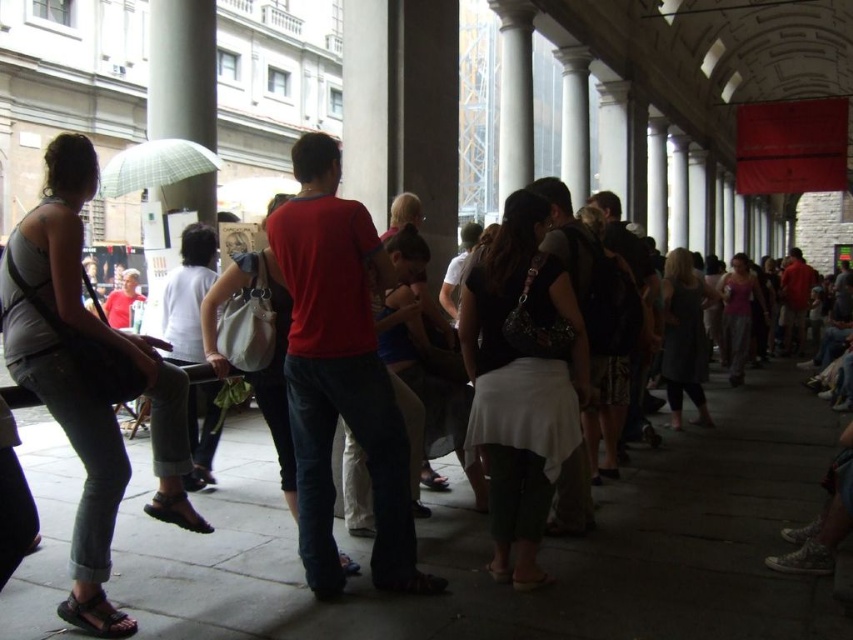
You are standing at the camera position and want to take a photo of the black textured skirt at center. Considering the distance, will you need a zoom lens to capture it clearly?

The black textured skirt at center is 33.26 meters away from camera, so yes, you will need a zoom lens to capture it clearly at that distance.